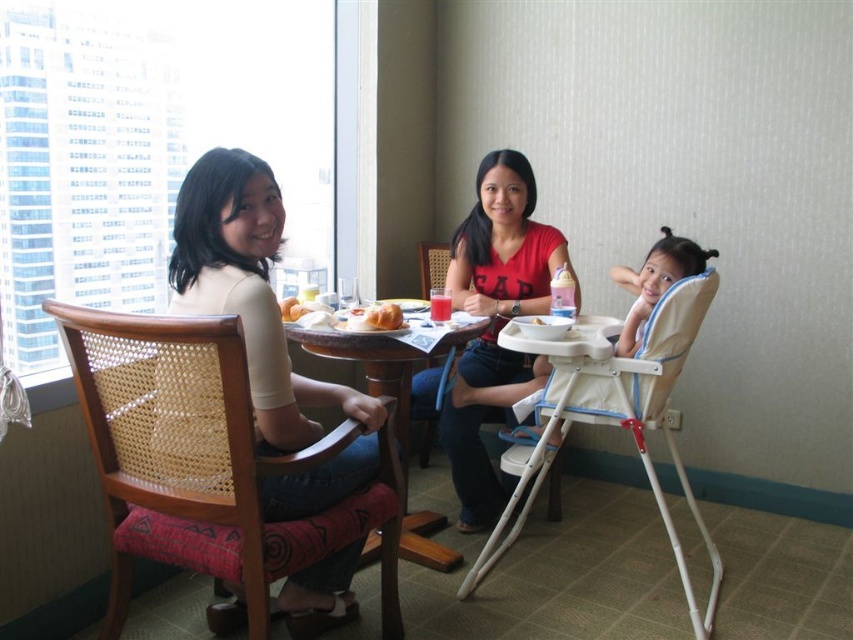
Question: Among these points, which one is nearest to the camera?

Choices:
 (A) (376, 324)
 (B) (296, 337)
 (C) (532, 323)

Answer: (A)

Question: Which point is closer to the camera taking this photo?

Choices:
 (A) (285, 320)
 (B) (546, 321)
 (C) (489, 410)

Answer: (B)

Question: Can you confirm if matte red shirt at center is bigger than woodenmaterial/texturetable at center?

Choices:
 (A) no
 (B) yes

Answer: (B)

Question: Which is nearer to the matte red shirt at center?

Choices:
 (A) woodenmaterial/texturetable at center
 (B) matte white high chair at center
 (C) matte yellow croissant at center

Answer: (A)

Question: From the image, what is the correct spatial relationship of woven wood chair at left in relation to matte red shirt at center?

Choices:
 (A) right
 (B) left

Answer: (B)

Question: Can you confirm if woven wood chair at center is positioned to the right of smooth white plate at center?

Choices:
 (A) yes
 (B) no

Answer: (B)